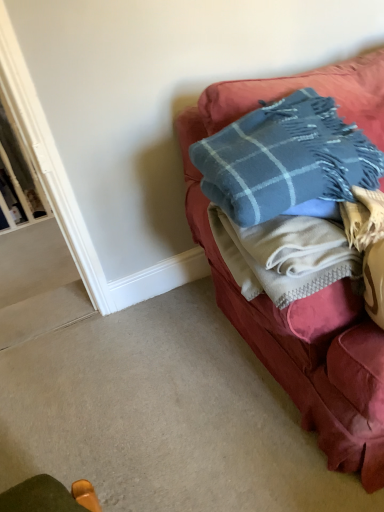
What do you see at coordinates (313, 294) in the screenshot?
I see `velvet red couch at right` at bounding box center [313, 294].

What is the approximate width of velvet red couch at right?

velvet red couch at right is 26.86 inches wide.

Identify the location of velvet red couch at right. (313, 294).

Locate an element on the screen. Image resolution: width=384 pixels, height=512 pixels. velvet red couch at right is located at coordinates (313, 294).